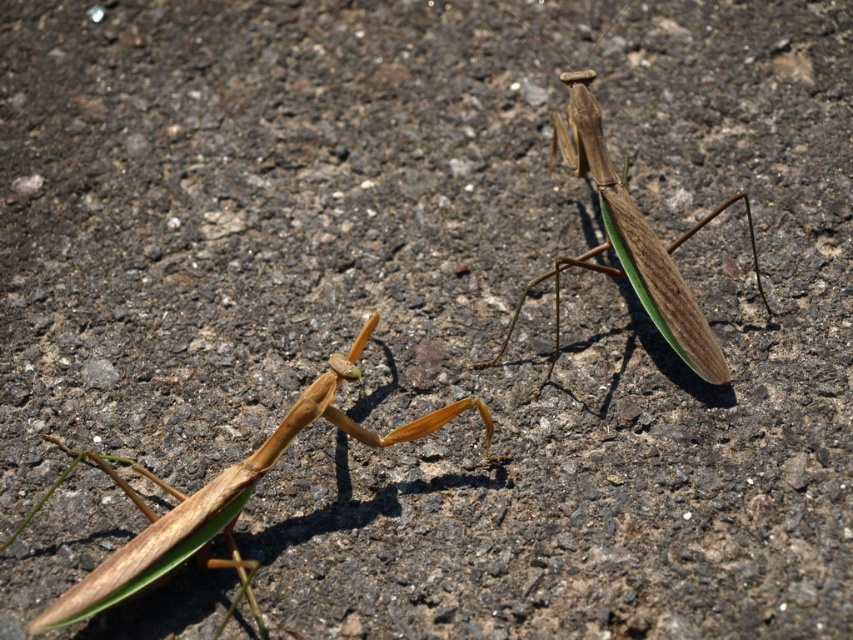
Does brown matte praying mantis at lower left have a greater height compared to brown matte/greenish wings at center?

No, brown matte praying mantis at lower left is not taller than brown matte/greenish wings at center.

Who is positioned more to the right, brown matte praying mantis at lower left or brown matte/greenish wings at center?

Positioned to the right is brown matte/greenish wings at center.

Image resolution: width=853 pixels, height=640 pixels. What do you see at coordinates (218, 500) in the screenshot? I see `brown matte praying mantis at lower left` at bounding box center [218, 500].

You are a GUI agent. You are given a task and a screenshot of the screen. Output one action in this format:
    pyautogui.click(x=<x>, y=<y>)
    Task: Click on the brown matte praying mantis at lower left
    The image size is (853, 640).
    Given the screenshot: What is the action you would take?
    pyautogui.click(x=218, y=500)